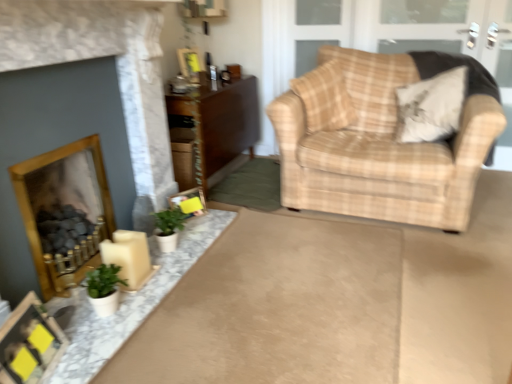
Question: Is green matte plant at lower left, positioned as the second houseplant in front-to-back order, aimed at beige plaid armchair at right?

Choices:
 (A) no
 (B) yes

Answer: (A)

Question: Can you confirm if green matte plant at lower left, which is counted as the 1th houseplant, starting from the back, is wider than beige plaid armchair at right?

Choices:
 (A) yes
 (B) no

Answer: (B)

Question: From the image's perspective, is green matte plant at lower left, which is counted as the 1th houseplant, starting from the back, located beneath beige plaid armchair at right?

Choices:
 (A) no
 (B) yes

Answer: (B)

Question: Considering the relative positions of green matte plant at lower left, positioned as the second houseplant in front-to-back order, and beige plaid armchair at right in the image provided, is green matte plant at lower left, positioned as the second houseplant in front-to-back order, to the left of beige plaid armchair at right from the viewer's perspective?

Choices:
 (A) yes
 (B) no

Answer: (A)

Question: Considering the relative sizes of green matte plant at lower left, positioned as the second houseplant in front-to-back order, and beige plaid armchair at right in the image provided, is green matte plant at lower left, positioned as the second houseplant in front-to-back order, shorter than beige plaid armchair at right?

Choices:
 (A) no
 (B) yes

Answer: (B)

Question: Is wooden picture frame at upper center, placed as the 3th picture frame when sorted from bottom to top, to the left or to the right of matte black picture frame at lower left, positioned as the 3th picture frame in right-to-left order, in the image?

Choices:
 (A) left
 (B) right

Answer: (B)

Question: Does point (190, 59) appear closer or farther from the camera than point (45, 352)?

Choices:
 (A) farther
 (B) closer

Answer: (A)

Question: From the image's perspective, is wooden picture frame at upper center, which is the second picture frame in left-to-right order, located above or below matte black picture frame at lower left, positioned as the 3th picture frame in right-to-left order?

Choices:
 (A) above
 (B) below

Answer: (A)

Question: Considering the positions of wooden picture frame at upper center, positioned as the first picture frame in back-to-front order, and matte black picture frame at lower left, the first picture frame in the front-to-back sequence, in the image, is wooden picture frame at upper center, positioned as the first picture frame in back-to-front order, bigger or smaller than matte black picture frame at lower left, the first picture frame in the front-to-back sequence,?

Choices:
 (A) big
 (B) small

Answer: (B)

Question: Is point (50, 359) positioned closer to the camera than point (323, 129)?

Choices:
 (A) closer
 (B) farther

Answer: (A)

Question: Is matte black picture frame at lower left, the first picture frame ordered from the bottom, wider or thinner than plaid fabric pillow at upper right, placed as the second pillow when sorted from right to left?

Choices:
 (A) thin
 (B) wide

Answer: (A)

Question: Looking at the image, does matte black picture frame at lower left, placed as the 3th picture frame when sorted from top to bottom, seem bigger or smaller compared to plaid fabric pillow at upper right, placed as the 1th pillow when sorted from left to right?

Choices:
 (A) big
 (B) small

Answer: (B)

Question: In terms of height, does matte black picture frame at lower left, the third picture frame when ordered from back to front, look taller or shorter compared to plaid fabric pillow at upper right, placed as the 1th pillow when sorted from left to right?

Choices:
 (A) short
 (B) tall

Answer: (A)

Question: Is wooden picture frame at upper center, which appears as the 3th picture frame when viewed from the front, inside or outside of wooden fireplace at lower left, the first fireplace from the back?

Choices:
 (A) outside
 (B) inside

Answer: (A)

Question: In the image, is wooden picture frame at upper center, positioned as the first picture frame in back-to-front order, on the left side or the right side of wooden fireplace at lower left, the 2th fireplace viewed from the front?

Choices:
 (A) right
 (B) left

Answer: (A)